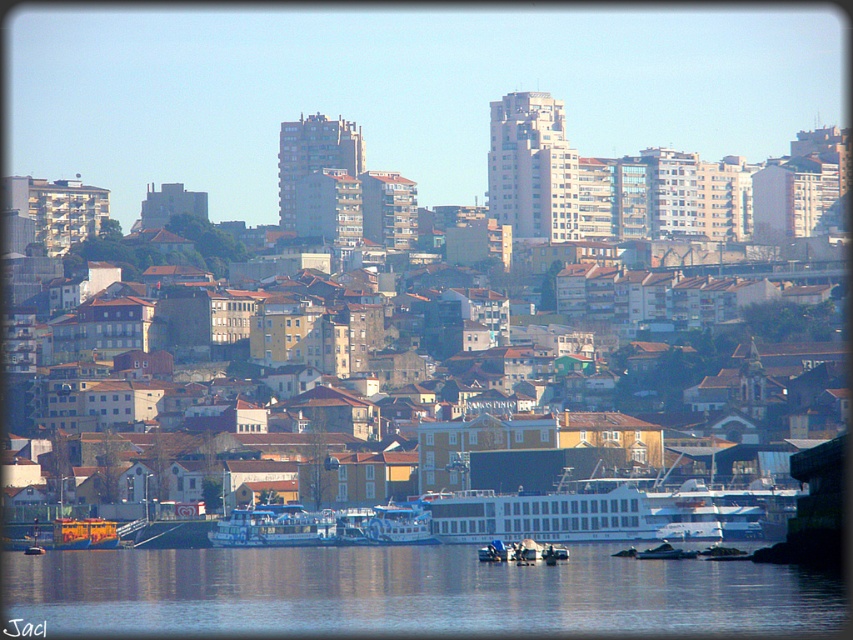
From the picture: You are a photographer standing at the riverside and want to capture both the transparent water at lower center and the blue glossy ferry at center in a single shot. Which object will appear closer to the camera in the photo?

The transparent water at lower center will appear closer to the camera because it is positioned in front of the blue glossy ferry at center.

You are a drone operator trying to capture the best aerial shot of the blue glossy ferry at center. Your drone is currently at coordinates 0.5, 0.5. Which direction should you move the drone to align with the ferry?

The blue glossy ferry at center is located at coordinates (273,525). Since the drone is at (426,320), you should move it northeast to align with the ferry.